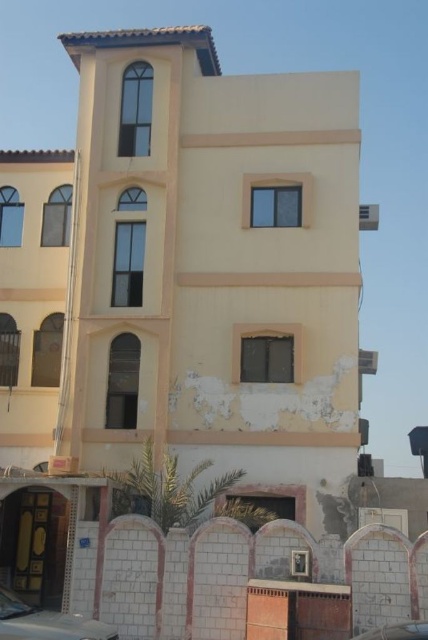
You are standing at the entrance of the residential building and want to park your metallic silver car at lower left. The parking lot has a designated parking spot at point 0.973, 0.107. Can you confirm if your car is parked correctly in the designated spot?

The metallic silver car at lower left is positioned at point (45, 621), so yes, it is parked correctly in the designated spot.

You are standing in front of the residential building and notice two points marked on the facade. The first point is located at coordinates point (74, 618) and the second at point (403, 624). Which of these points is nearer to your current position?

Point (74, 618) is closer to the camera than point (403, 624), so the first point is nearer to your current position.